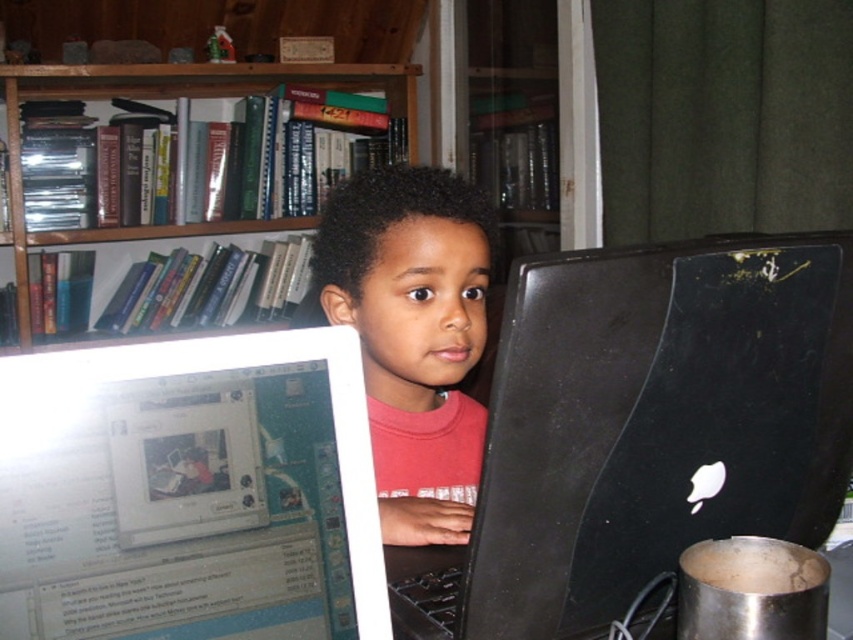
You are a teacher observing a student working at a desk with two computer monitors. The student is focused on something off camera. You notice a point at coordinates [189,492]. Based on the scene description, what object is located at that point?

The point at coordinates [189,492] corresponds to the white glossy computer screen at center.

In the scene shown: You are a teacher observing a student working at a desk with two monitors. You need to check the student is using both screens properly. The student has a black matte laptop at center and a white glossy computer screen at center. Which monitor is on the right side from your perspective?

The black matte laptop at center is positioned on the right side of the white glossy computer screen at center, so from your perspective, the black matte laptop at center is on the right.

You are a photographer trying to capture a closeup of the pink matte shirt at center. You notice the white glossy computer screen at center is blocking your view. Which direction should you move your camera to avoid the screen?

The white glossy computer screen at center is to the left of the pink matte shirt at center, so you should move your camera to the right to avoid the screen.